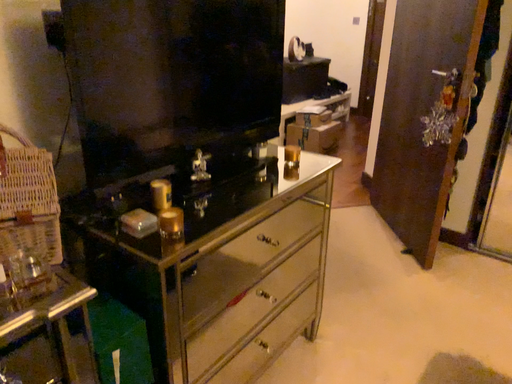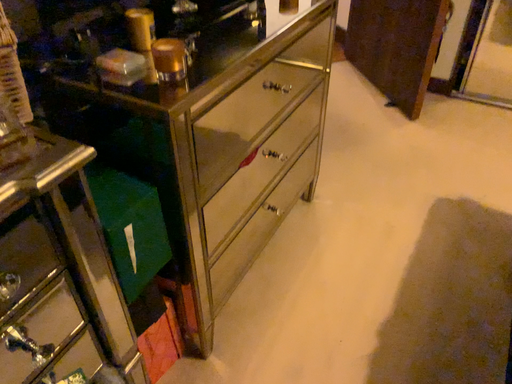
Question: How did the camera likely rotate when shooting the video?

Choices:
 (A) rotated upward
 (B) rotated downward

Answer: (B)